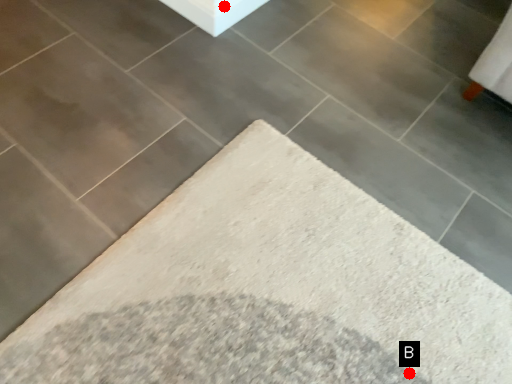
Question: Two points are circled on the image, labeled by A and B beside each circle. Which point is closer to the camera taking this photo?

Choices:
 (A) A is closer
 (B) B is closer

Answer: (B)